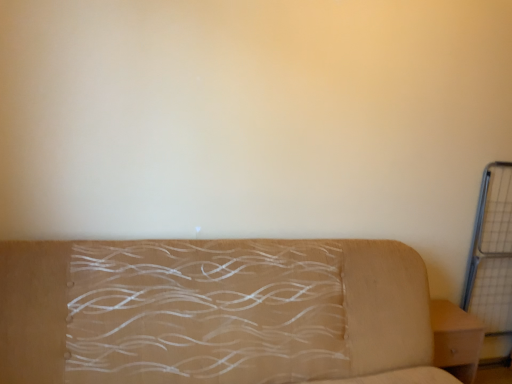
Question: In the image, is metal grid at right on the left side or the right side of light brown wood nightstand at lower right?

Choices:
 (A) left
 (B) right

Answer: (B)

Question: From the image's perspective, is metal grid at right located above or below light brown wood nightstand at lower right?

Choices:
 (A) above
 (B) below

Answer: (A)

Question: Estimate the real-world distances between objects in this image. Which object is closer to the light brown wood nightstand at lower right?

Choices:
 (A) metal grid at right
 (B) beige fabric couch at center

Answer: (A)

Question: Based on their relative distances, which object is nearer to the beige fabric couch at center?

Choices:
 (A) light brown wood nightstand at lower right
 (B) metal grid at right

Answer: (A)